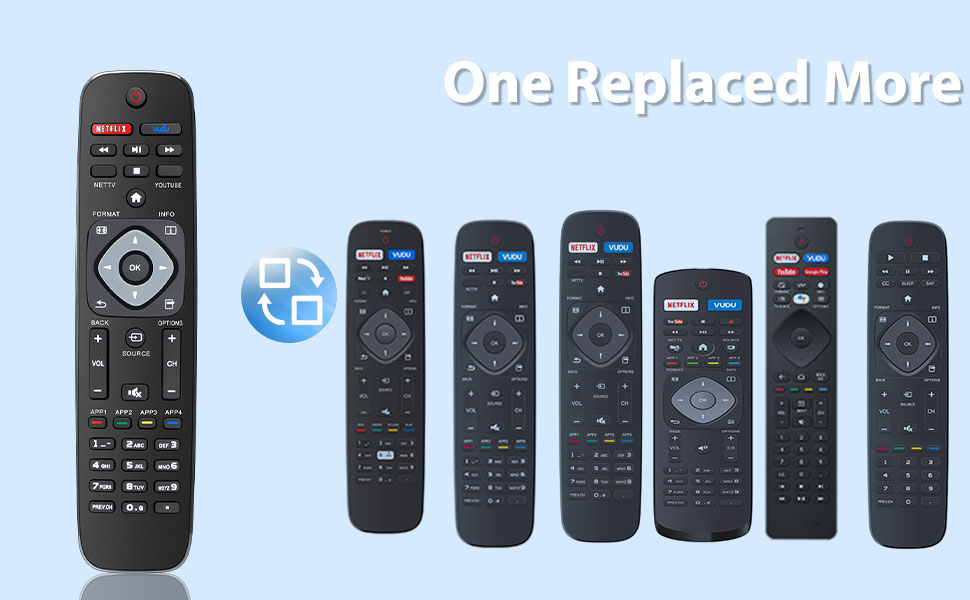
Identify the location of remote controls. (158, 271), (397, 345), (491, 346), (606, 353), (748, 369), (820, 362), (883, 357).